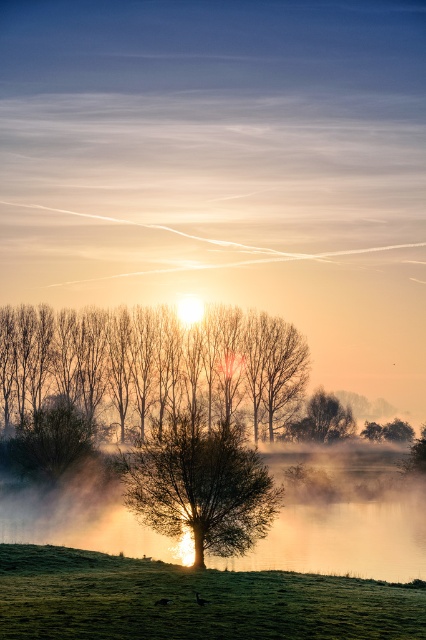
You are standing at the point marked by the coordinates point (201, 486) in the image. What object are you directly facing?

The point (201, 486) indicates the green leafy tree at center, so you are directly facing the green leafy tree at center.

You are standing in the field looking at the green leafy tree at center. If you walk straight towards it for 100 feet, will you reach the tree?

The green leafy tree at center is 116.02 feet away from the viewer. After walking 100 feet, you will still be 16.02 feet away from the tree, so you won not reach it.

You are standing in the middle of the green grassy field at lower center and want to walk towards the smooth brown tree at left. Which direction should you head?

Since the green grassy field at lower center is positioned on the right side of smooth brown tree at left, you should head to the left to reach the smooth brown tree at left from the green grassy field at lower center.